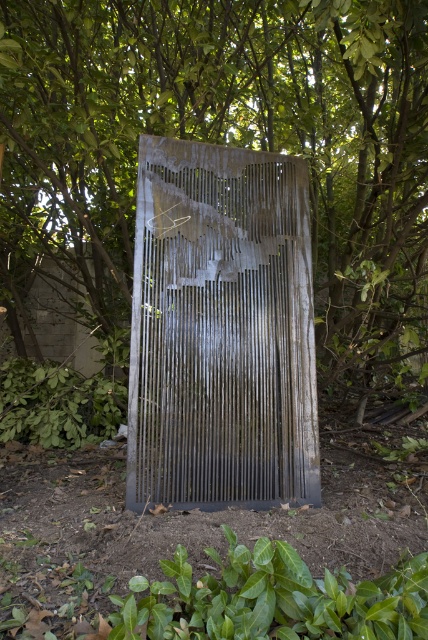
You are standing in front of the image and notice the rusty metal sculpture at center and the rusty metal screen door at center. Which object is positioned higher in the image?

The rusty metal sculpture at center is positioned higher than the rusty metal screen door at center in the image.